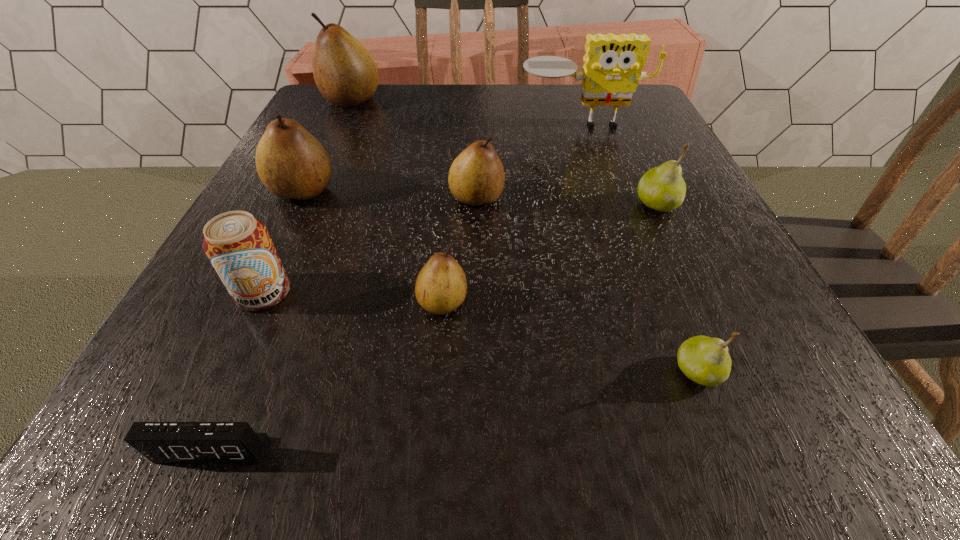
Locate an element on the screen. This screenshot has width=960, height=540. free space at the far edge is located at coordinates (389, 85).

Where is `vacant position at the near edge of the desktop`? vacant position at the near edge of the desktop is located at coordinates (362, 463).

In the image, there is a desktop. Identify the location of vacant space at the left edge. (299, 275).

I want to click on vacant space at the right edge of the desktop, so click(x=654, y=254).

Identify the location of vacant region at the far left corner of the desktop. (361, 120).

In the image, there is a desktop. Where is `vacant space at the far right corner`? The height and width of the screenshot is (540, 960). vacant space at the far right corner is located at coordinates pos(618,113).

Image resolution: width=960 pixels, height=540 pixels. I want to click on vacant region at the near right corner of the desktop, so click(781, 469).

At what (x,y) coordinates should I click in order to perform the action: click on free area in between the yellow sponge and the second smallest brown pear. Please return your answer as a coordinate pair (x, y). The width and height of the screenshot is (960, 540). Looking at the image, I should click on (530, 161).

The height and width of the screenshot is (540, 960). Identify the location of vacant area that lies between the second smallest brown pear and the nearest brown pear. (460, 251).

Locate an element on the screen. The height and width of the screenshot is (540, 960). blank region between the second biggest brown pear and the third biggest brown pear is located at coordinates (390, 194).